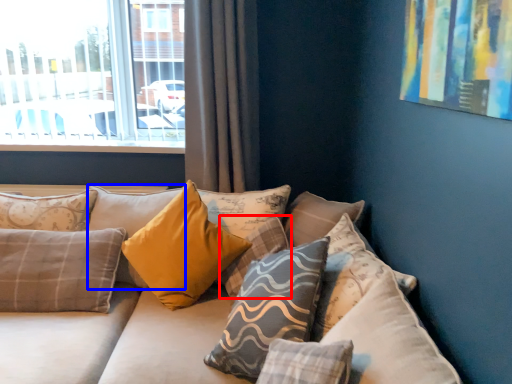
Question: Which of the following is the closest to the observer, pillow (highlighted by a red box) or pillow (highlighted by a blue box)?

Choices:
 (A) pillow
 (B) pillow

Answer: (A)